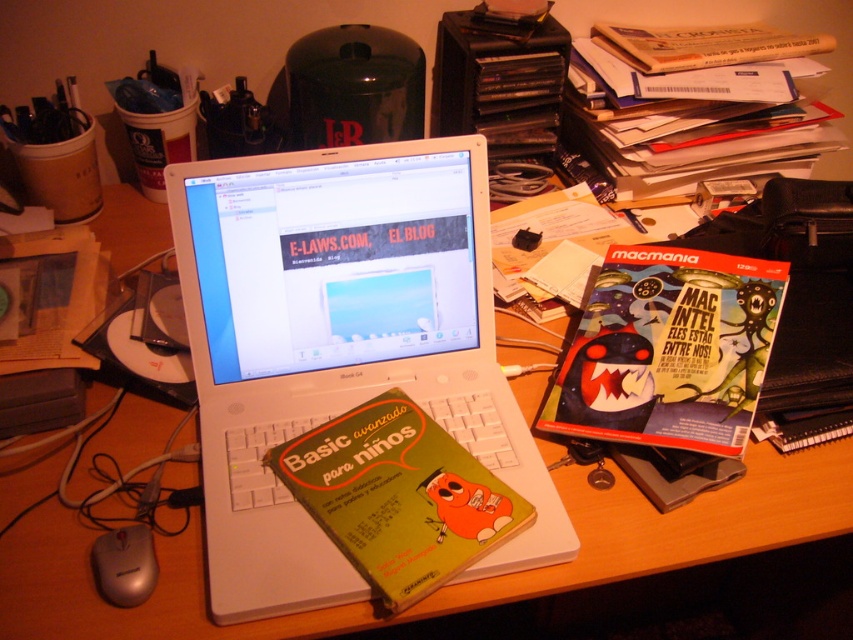
You are trying to locate the white plastic laptop at center on a cluttered desk. According to the coordinates provided, where is it positioned?

The white plastic laptop at center is positioned at coordinates point (339,346).

You are organizing your desk and want to place a new notebook. The notebook is 10 cm wide. There is a space at point (669, 349). Can the notebook fit there?

The space at point (669, 349) has a matte plastic comic book at right. Since the comic book is occupying the space, the notebook cannot fit there.